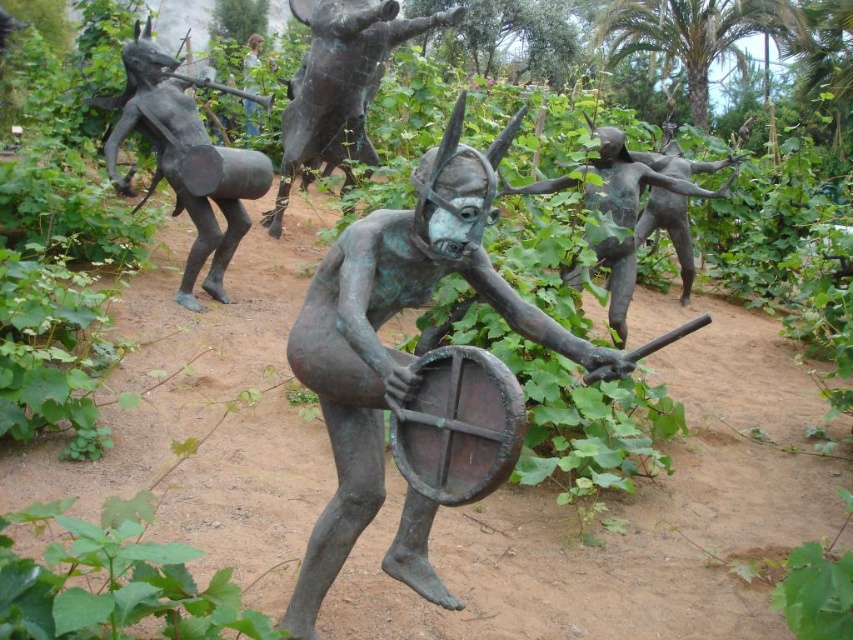
You are standing in the garden where the bronze sculptures are displayed. You notice two points marked in the image. The first point is at coordinates point (x=425, y=26) and the second is at point (x=252, y=108). Which point is closer to you?

Point (x=425, y=26) is in front of point (x=252, y=108), so it is closer to you.

You are a tour guide leading a group through an outdoor sculpture garden. You want to point out the bronze statue at center to your visitors. Based on its coordinates, where should you direct their attention?

The bronze statue at center is located at coordinates point (392, 348), so you should direct their attention to the central area of the image where the coordinates indicate its position.